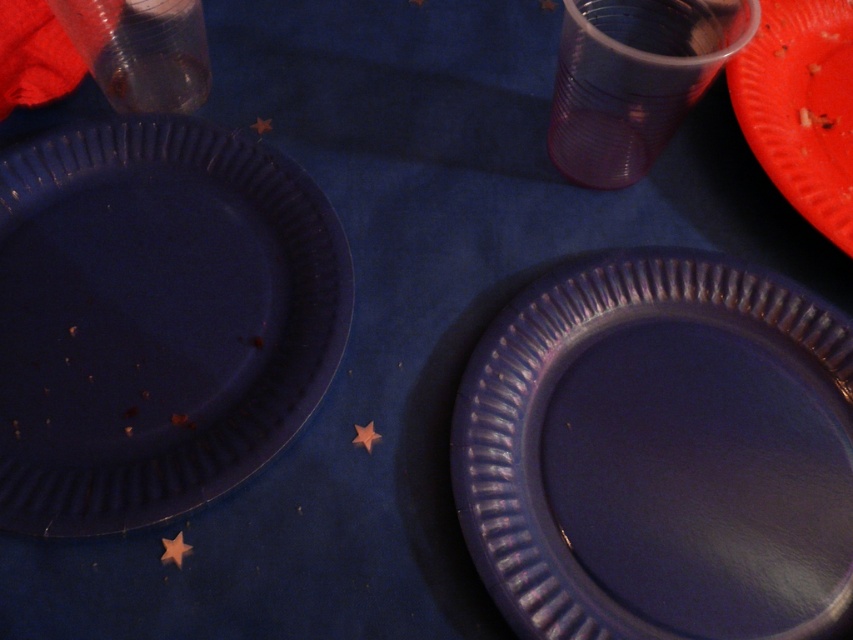
You are setting up a birthday party and want to place a 9 inch wide ribbon between the matte blue plate at lower right and the orange matte plate at upper right. Will the ribbon fit between them?

The distance between the matte blue plate at lower right and the orange matte plate at upper right is 8.60 inches. Since the ribbon is 9 inches wide, it will not fit between them as the space is slightly smaller than the ribbon.

You are setting up a birthday party and need to arrange snacks on the table. You have two plates, the matte blue plate at lower left and the orange matte plate at upper right. Which plate is positioned lower on the table?

The matte blue plate at lower left is positioned lower on the table than the orange matte plate at upper right.

You are a person with a 24 inch long arm. You are sitting at the table and want to reach the matte blue plate at lower right. Can you reach it with your arm fully extended?

The matte blue plate at lower right is 23.43 inches away from viewer, so yes, you can reach it with your arm fully extended since your arm is 24 inches long.